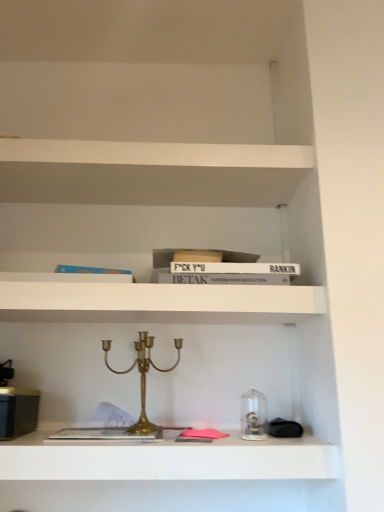
Question: Which direction should I rotate to face metallic gold candelabra at center, which is counted as the second shelf, starting from the top, — up or down?

Choices:
 (A) down
 (B) up

Answer: (A)

Question: Is white matte bookshelf at upper center, arranged as the 1th shelf when viewed from the top, a part of metallic gold candelabra at center, the 1th shelf ordered from the bottom?

Choices:
 (A) yes
 (B) no

Answer: (B)

Question: From a real-world perspective, is metallic gold candelabra at center, which is counted as the second shelf, starting from the top, over white matte bookshelf at upper center, arranged as the 1th shelf when viewed from the top?

Choices:
 (A) no
 (B) yes

Answer: (A)

Question: Can you confirm if metallic gold candelabra at center, which is counted as the second shelf, starting from the top, is shorter than white matte bookshelf at upper center, which appears as the 2th shelf when ordered from the bottom?

Choices:
 (A) yes
 (B) no

Answer: (B)

Question: Is metallic gold candelabra at center, which is counted as the second shelf, starting from the top, bigger than white matte bookshelf at upper center, arranged as the 1th shelf when viewed from the top?

Choices:
 (A) yes
 (B) no

Answer: (B)

Question: Considering the relative positions of metallic gold candelabra at center, which is counted as the second shelf, starting from the top, and white matte bookshelf at upper center, arranged as the 1th shelf when viewed from the top, in the image provided, is metallic gold candelabra at center, which is counted as the second shelf, starting from the top, in front of white matte bookshelf at upper center, arranged as the 1th shelf when viewed from the top,?

Choices:
 (A) no
 (B) yes

Answer: (B)

Question: Can you confirm if metallic gold candelabra at center, which is counted as the second shelf, starting from the top, is positioned to the right of white matte bookshelf at upper center, arranged as the 1th shelf when viewed from the top?

Choices:
 (A) yes
 (B) no

Answer: (A)

Question: Is white matte bookshelf at upper center, which appears as the 2th shelf when ordered from the bottom, bigger than metallic gold candelabra at center, the 1th shelf ordered from the bottom?

Choices:
 (A) no
 (B) yes

Answer: (B)

Question: Can you confirm if white matte bookshelf at upper center, which appears as the 2th shelf when ordered from the bottom, is wider than metallic gold candelabra at center, which is counted as the second shelf, starting from the top?

Choices:
 (A) yes
 (B) no

Answer: (B)

Question: Is white matte bookshelf at upper center, arranged as the 1th shelf when viewed from the top, oriented away from metallic gold candelabra at center, the 1th shelf ordered from the bottom?

Choices:
 (A) yes
 (B) no

Answer: (B)

Question: Can you confirm if white matte bookshelf at upper center, which appears as the 2th shelf when ordered from the bottom, is positioned to the right of metallic gold candelabra at center, the 1th shelf ordered from the bottom?

Choices:
 (A) yes
 (B) no

Answer: (B)

Question: Is white matte bookshelf at upper center, which appears as the 2th shelf when ordered from the bottom, in front of metallic gold candelabra at center, the 1th shelf ordered from the bottom?

Choices:
 (A) yes
 (B) no

Answer: (B)

Question: From a real-world perspective, is white matte bookshelf at upper center, arranged as the 1th shelf when viewed from the top, located beneath metallic gold candelabra at center, the 1th shelf ordered from the bottom?

Choices:
 (A) no
 (B) yes

Answer: (A)

Question: Is white matte bookshelf at upper center, which appears as the 2th shelf when ordered from the bottom, not within gold brass candle holder at center?

Choices:
 (A) yes
 (B) no

Answer: (A)